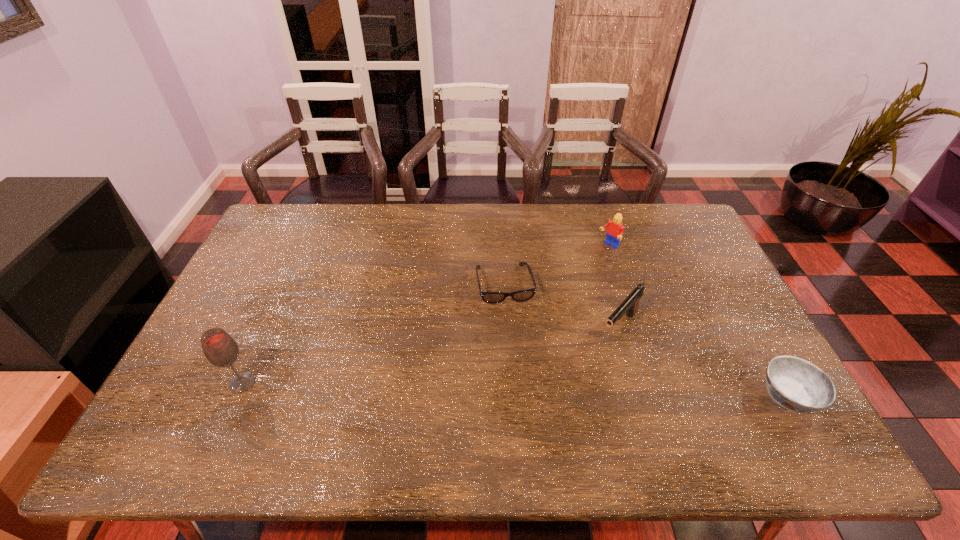
Where is `object present at the left edge`? object present at the left edge is located at coordinates (220, 349).

The image size is (960, 540). In order to click on object positioned at the right edge in this screenshot , I will do `click(794, 383)`.

Find the location of a particular element. The image size is (960, 540). object present at the near left corner is located at coordinates (220, 349).

Locate an element on the screen. The width and height of the screenshot is (960, 540). object present at the near right corner is located at coordinates (794, 383).

The width and height of the screenshot is (960, 540). In the image, there is a desktop. In order to click on vacant space at the far edge in this screenshot , I will do `click(404, 219)`.

Where is `vacant space at the near edge of the desktop`? The height and width of the screenshot is (540, 960). vacant space at the near edge of the desktop is located at coordinates (591, 414).

Find the location of a particular element. vacant position at the left edge of the desktop is located at coordinates (185, 374).

Where is `free space at the right edge of the desktop`? free space at the right edge of the desktop is located at coordinates (692, 265).

You are a GUI agent. You are given a task and a screenshot of the screen. Output one action in this format:
    pyautogui.click(x=<x>, y=<y>)
    Task: Click on the vacant region at the far left corner
    The height and width of the screenshot is (540, 960).
    Given the screenshot: What is the action you would take?
    pyautogui.click(x=297, y=212)

Identify the location of blank space at the near left corner of the desktop. (216, 406).